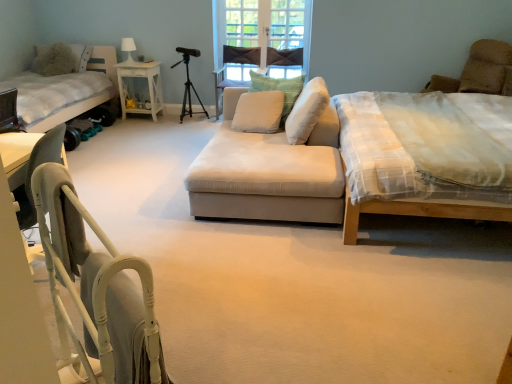
The width and height of the screenshot is (512, 384). Describe the element at coordinates (147, 86) in the screenshot. I see `white wood side table at center` at that location.

The width and height of the screenshot is (512, 384). What do you see at coordinates (415, 212) in the screenshot? I see `white checkered fabric bed at right, the 2th bed from the left` at bounding box center [415, 212].

In order to click on beige fabric couch at center in this screenshot , I will do [x=272, y=164].

Where is `fluffy white pillow at upper left, which is the 1th pillow from back to front`? The height and width of the screenshot is (384, 512). fluffy white pillow at upper left, which is the 1th pillow from back to front is located at coordinates (80, 56).

At what (x,y) coordinates should I click in order to perform the action: click on white fabric folding chair at lower left. Please return your answer as a coordinate pair (x, y). Looking at the image, I should click on (97, 287).

What is the approximate width of white soft cushion at center, which is the second pillow in left-to-right order?

The width of white soft cushion at center, which is the second pillow in left-to-right order, is 44.38 centimeters.

The height and width of the screenshot is (384, 512). What are the coordinates of `white fabric bed at left, marked as the first bed in a left-to-right arrangement` in the screenshot? It's located at (64, 91).

From the image's perspective, would you say fluffy white pillow at upper left, the 1th pillow viewed from the left, is shown under white soft cushion at center, acting as the 3th pillow starting from the right?

Actually, fluffy white pillow at upper left, the 1th pillow viewed from the left, appears above white soft cushion at center, acting as the 3th pillow starting from the right, in the image.

Is fluffy white pillow at upper left, the 1th pillow viewed from the left, oriented away from white soft cushion at center, which ranks as the 3th pillow in back-to-front order?

No.

Locate an element on the screen. This screenshot has width=512, height=384. pillow on the left of white soft cushion at center, acting as the 3th pillow starting from the right is located at coordinates (80, 56).

Is fluffy white pillow at upper left, which appears as the fourth pillow when viewed from the right, next to white soft cushion at center, which is the second pillow in left-to-right order, and touching it?

fluffy white pillow at upper left, which appears as the fourth pillow when viewed from the right, is not next to white soft cushion at center, which is the second pillow in left-to-right order, and they're not touching.

From the image's perspective, is white fabric bed at left, marked as the first bed in a left-to-right arrangement, above metallic tripod at center?

No, from the image's perspective, white fabric bed at left, marked as the first bed in a left-to-right arrangement, is not above metallic tripod at center.

From a real-world perspective, between white fabric bed at left, marked as the first bed in a left-to-right arrangement, and metallic tripod at center, who is vertically higher?

white fabric bed at left, marked as the first bed in a left-to-right arrangement, from a real-world perspective.

Between white fabric bed at left, marked as the first bed in a left-to-right arrangement, and metallic tripod at center, which one is positioned behind?

metallic tripod at center is behind.

Can you confirm if white fabric bed at left, marked as the first bed in a left-to-right arrangement, is positioned to the right of metallic tripod at center?

Incorrect, white fabric bed at left, marked as the first bed in a left-to-right arrangement, is not on the right side of metallic tripod at center.

Between brown suede armchair at upper right and white fabric folding chair at lower left, which one has larger size?

brown suede armchair at upper right.

Can you confirm if brown suede armchair at upper right is thinner than white fabric folding chair at lower left?

In fact, brown suede armchair at upper right might be wider than white fabric folding chair at lower left.

From the image's perspective, who appears lower, brown suede armchair at upper right or white fabric folding chair at lower left?

white fabric folding chair at lower left, from the image's perspective.

From a real-world perspective, who is located lower, brown suede armchair at upper right or white fabric folding chair at lower left?

white fabric folding chair at lower left is physically lower.

Considering the positions of objects white soft pillow at center, the 4th pillow in the left-to-right sequence, and white checkered fabric bed at right, the 2th bed from the left, in the image provided, who is more to the left, white soft pillow at center, the 4th pillow in the left-to-right sequence, or white checkered fabric bed at right, the 2th bed from the left,?

From the viewer's perspective, white soft pillow at center, the 4th pillow in the left-to-right sequence, appears more on the left side.

Can you confirm if white soft pillow at center, marked as the 1th pillow in a right-to-left arrangement, is thinner than white checkered fabric bed at right, which is counted as the 1th bed, starting from the right?

Yes, white soft pillow at center, marked as the 1th pillow in a right-to-left arrangement, is thinner than white checkered fabric bed at right, which is counted as the 1th bed, starting from the right.

In the scene shown: Who is bigger, white soft pillow at center, marked as the 1th pillow in a right-to-left arrangement, or white checkered fabric bed at right, the 2th bed from the left?

white checkered fabric bed at right, the 2th bed from the left.

Looking at this image, is metallic tripod at center positioned far away from fluffy white pillow at upper left, the 1th pillow viewed from the left?

Absolutely, metallic tripod at center is distant from fluffy white pillow at upper left, the 1th pillow viewed from the left.

Can you confirm if metallic tripod at center is positioned to the left of fluffy white pillow at upper left, which is the 1th pillow from back to front?

Incorrect, metallic tripod at center is not on the left side of fluffy white pillow at upper left, which is the 1th pillow from back to front.

In terms of size, does metallic tripod at center appear bigger or smaller than fluffy white pillow at upper left, the 1th pillow viewed from the left?

metallic tripod at center is bigger than fluffy white pillow at upper left, the 1th pillow viewed from the left.

Considering the relative sizes of metallic tripod at center and fluffy white pillow at upper left, the 1th pillow viewed from the left, in the image provided, is metallic tripod at center wider than fluffy white pillow at upper left, the 1th pillow viewed from the left,?

Yes, metallic tripod at center is wider than fluffy white pillow at upper left, the 1th pillow viewed from the left.

Based on the photo, from a real-world perspective, who is located higher, white soft pillow at center, marked as the 1th pillow in a right-to-left arrangement, or beige fabric couch at center?

From a 3D spatial view, white soft pillow at center, marked as the 1th pillow in a right-to-left arrangement, is above.

Is white soft pillow at center, marked as the 1th pillow in a right-to-left arrangement, beside beige fabric couch at center?

white soft pillow at center, marked as the 1th pillow in a right-to-left arrangement, and beige fabric couch at center are clearly separated.

Which of these two, white soft pillow at center, the 1th pillow viewed from the front, or beige fabric couch at center, is thinner?

white soft pillow at center, the 1th pillow viewed from the front.

Is white soft pillow at center, marked as the 1th pillow in a right-to-left arrangement, located outside beige fabric couch at center?

No.

From the image's perspective, between white checkered fabric bed at right, which is counted as the 1th bed, starting from the right, and white wood side table at center, which one is located above?

white wood side table at center.

Could white wood side table at center be considered to be inside white checkered fabric bed at right, which is counted as the 1th bed, starting from the right?

No, white wood side table at center is not a part of white checkered fabric bed at right, which is counted as the 1th bed, starting from the right.

Is white checkered fabric bed at right, which is counted as the 1th bed, starting from the right, positioned with its back to white wood side table at center?

No, white checkered fabric bed at right, which is counted as the 1th bed, starting from the right, is not facing away from white wood side table at center.

Does point (481, 48) lie in front of point (118, 84)?

Yes, it is.

The image size is (512, 384). In order to click on the 2nd pillow above when counting from the white soft cushion at center, which ranks as the 3th pillow in back-to-front order (from the image's perspective) in this screenshot , I will do `click(80, 56)`.

From a real-world perspective, which bed is the 2nd one above the metallic tripod at center? Please provide its 2D coordinates.

[(64, 91)]

Estimate the real-world distances between objects in this image. Which object is further from white fabric bed at left, the second bed in the right-to-left sequence, white fabric folding chair at lower left or metallic tripod at center?

white fabric folding chair at lower left lies further to white fabric bed at left, the second bed in the right-to-left sequence, than the other object.

Based on their spatial positions, is white soft cushion at center, the third pillow from the left, or metallic tripod at center further from brown suede armchair at upper right?

metallic tripod at center lies further to brown suede armchair at upper right than the other object.

Estimate the real-world distances between objects in this image. Which object is closer to metallic tripod at center, white checkered fabric bed at right, which is counted as the 1th bed, starting from the right, or white fabric bed at left, marked as the first bed in a left-to-right arrangement?

The object closer to metallic tripod at center is white fabric bed at left, marked as the first bed in a left-to-right arrangement.

Estimate the real-world distances between objects in this image. Which object is closer to white soft pillow at center, the 4th pillow in the back-to-front sequence, fluffy white pillow at upper left, the 4th pillow positioned from the front, or white soft cushion at center, arranged as the second pillow when viewed from the front?

white soft cushion at center, arranged as the second pillow when viewed from the front, is positioned closer to the anchor white soft pillow at center, the 4th pillow in the back-to-front sequence.

Consider the image. Estimate the real-world distances between objects in this image. Which object is further from fluffy white pillow at upper left, the 4th pillow positioned from the front, beige fabric couch at center or white soft cushion at center, the second pillow when ordered from right to left?

beige fabric couch at center is further to fluffy white pillow at upper left, the 4th pillow positioned from the front.

Based on their spatial positions, is white soft cushion at center, which is the second pillow in left-to-right order, or fluffy white pillow at upper left, which is the 1th pillow from back to front, closer to white soft cushion at center, the second pillow when ordered from right to left?

white soft cushion at center, which is the second pillow in left-to-right order.

Based on the photo, when comparing their distances from white wood side table at center, does metallic tripod at center or white soft pillow at center, the 4th pillow in the back-to-front sequence, seem further?

white soft pillow at center, the 4th pillow in the back-to-front sequence, is positioned further to the anchor white wood side table at center.

Estimate the real-world distances between objects in this image. Which object is closer to white soft cushion at center, acting as the 3th pillow starting from the right, beige fabric couch at center or metallic tripod at center?

beige fabric couch at center lies closer to white soft cushion at center, acting as the 3th pillow starting from the right, than the other object.

At what (x,y) coordinates should I click in order to perform the action: click on studio couch between white fabric folding chair at lower left and metallic tripod at center in the front-back direction. Please return your answer as a coordinate pair (x, y). This screenshot has width=512, height=384. Looking at the image, I should click on (272, 164).

This screenshot has height=384, width=512. Find the location of `table situated between white fabric bed at left, the second bed in the right-to-left sequence, and white soft pillow at center, marked as the 1th pillow in a right-to-left arrangement, from left to right`. table situated between white fabric bed at left, the second bed in the right-to-left sequence, and white soft pillow at center, marked as the 1th pillow in a right-to-left arrangement, from left to right is located at coordinates (147, 86).

Identify the location of tripod between fluffy white pillow at upper left, the 4th pillow positioned from the front, and white checkered fabric bed at right, which is counted as the 1th bed, starting from the right, in the horizontal direction. (189, 92).

Image resolution: width=512 pixels, height=384 pixels. What are the coordinates of `folding chair located between white fabric bed at left, the second bed in the right-to-left sequence, and brown suede armchair at upper right in the left-right direction` in the screenshot? It's located at (97, 287).